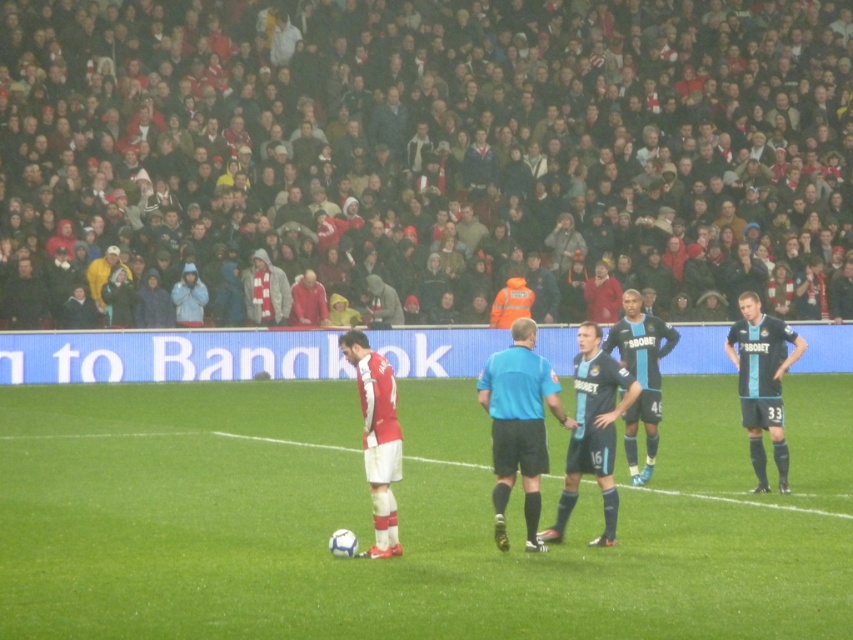
You are a photographer at the soccer match. You want to capture a photo where the white matte football at center is clearly visible in the foreground while also showing the dark gray hoodies at upper center in the background. Is this possible given their positions?

Yes, since the dark gray hoodies at upper center are located above the white matte football at center, positioning the camera to focus on the football at center will naturally place the hoodies in the background, making both visible in the desired composition.

You are a photographer at the soccer match. You want to capture a photo that includes both the dark gray hoodies at upper center and the blue jersey at center. Which object will appear wider in the photo?

The dark gray hoodies at upper center will appear wider in the photo because its width is larger than the blue jersey at center.